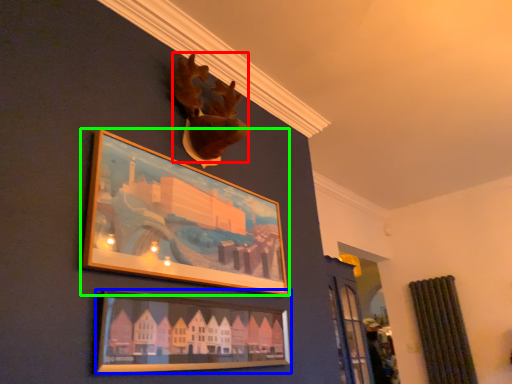
Question: Considering the real-world distances, which object is closest to animal (highlighted by a red box)? picture frame (highlighted by a blue box) or picture frame (highlighted by a green box).

Choices:
 (A) picture frame
 (B) picture frame

Answer: (B)